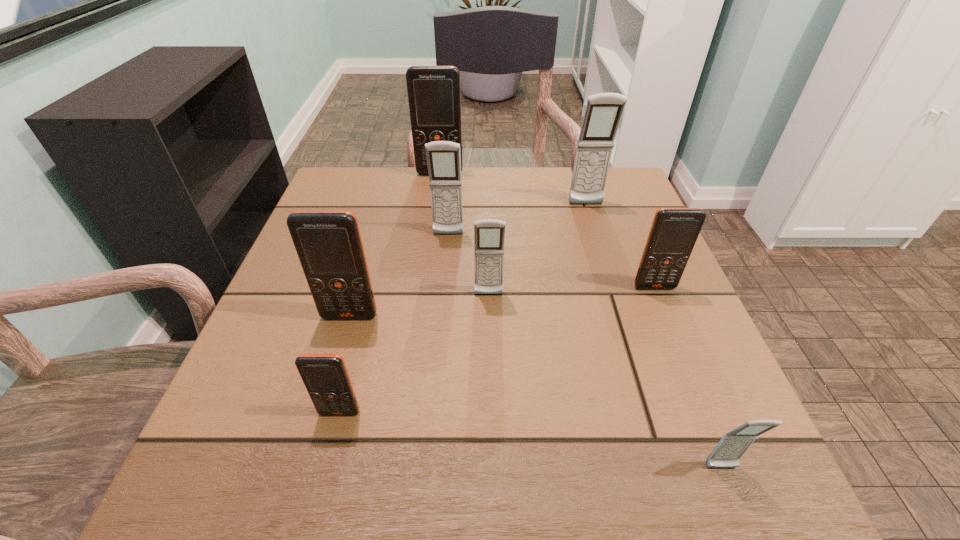
At what (x,y) coordinates should I click in order to perform the action: click on vacant area that lies between the third gray cellular telephone from left to right and the rightmost orange cellular telephone. Please return your answer as a coordinate pair (x, y). This screenshot has height=540, width=960. Looking at the image, I should click on (620, 246).

At what (x,y) coordinates should I click in order to perform the action: click on free space between the second farthest gray cellular telephone and the rightmost orange cellular telephone. Please return your answer as a coordinate pair (x, y). The image size is (960, 540). Looking at the image, I should click on coord(551,261).

Select which object is the sixth closest to the rightmost gray cellular telephone. Please provide its 2D coordinates. Your answer should be formatted as a tuple, i.e. [(x, y)], where the tuple contains the x and y coordinates of a point satisfying the conditions above.

[(603, 112)]

Choose which object is the sixth nearest neighbor to the leftmost gray cellular telephone. Please provide its 2D coordinates. Your answer should be formatted as a tuple, i.e. [(x, y)], where the tuple contains the x and y coordinates of a point satisfying the conditions above.

[(325, 376)]

The image size is (960, 540). In order to click on the fifth closest cellular telephone to the fourth cellular telephone from right to left in this screenshot , I will do `click(603, 112)`.

Select which cellular telephone appears as the seventh closest to the third biggest gray cellular telephone. Please provide its 2D coordinates. Your answer should be formatted as a tuple, i.e. [(x, y)], where the tuple contains the x and y coordinates of a point satisfying the conditions above.

[(434, 98)]

I want to click on orange cellular telephone that stands as the third closest to the second farthest orange cellular telephone, so click(x=325, y=376).

Identify the location of orange cellular telephone that is the second closest to the second smallest orange cellular telephone. (434, 98).

At what (x,y) coordinates should I click in order to perform the action: click on gray cellular telephone that is the third closest to the third biggest gray cellular telephone. Please return your answer as a coordinate pair (x, y). This screenshot has width=960, height=540. Looking at the image, I should click on (733, 445).

At what (x,y) coordinates should I click in order to perform the action: click on gray cellular telephone that is the third closest one to the fourth object from right to left. Please return your answer as a coordinate pair (x, y). Looking at the image, I should click on (733, 445).